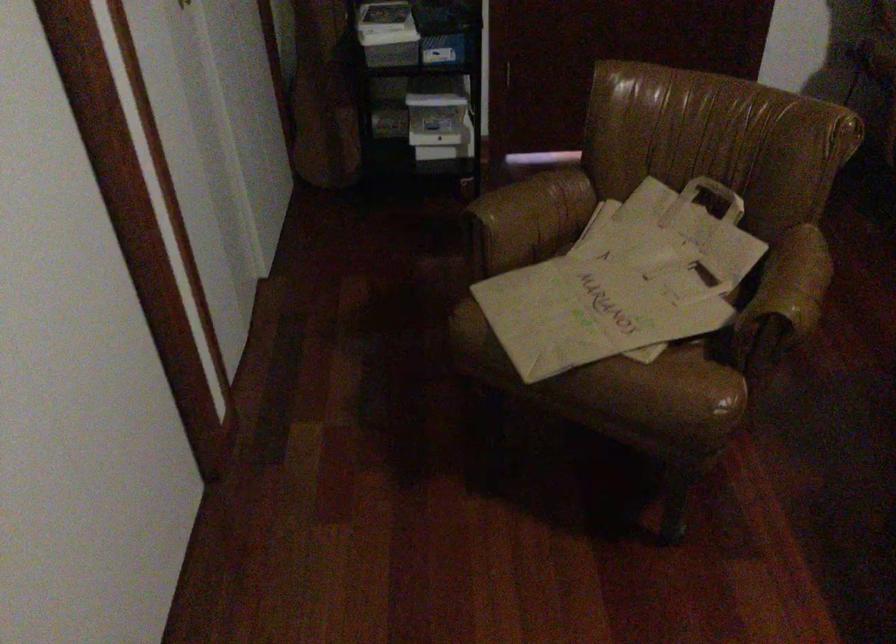
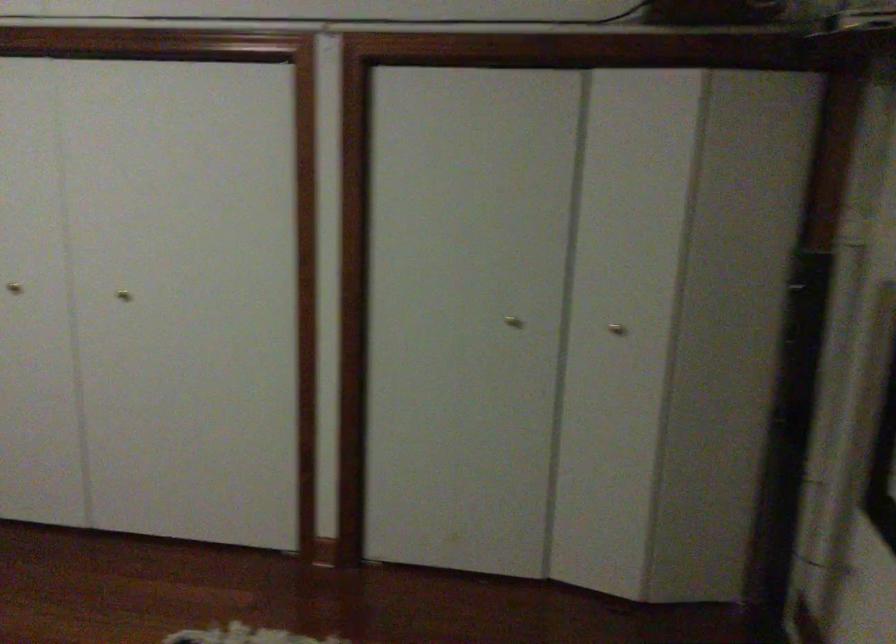
Question: The camera is either moving clockwise (left) or counter-clockwise (right) around the object. The first image is from the beginning of the video and the second image is from the end. Is the camera moving left or right when shooting the video?

Choices:
 (A) Left
 (B) Right

Answer: (A)